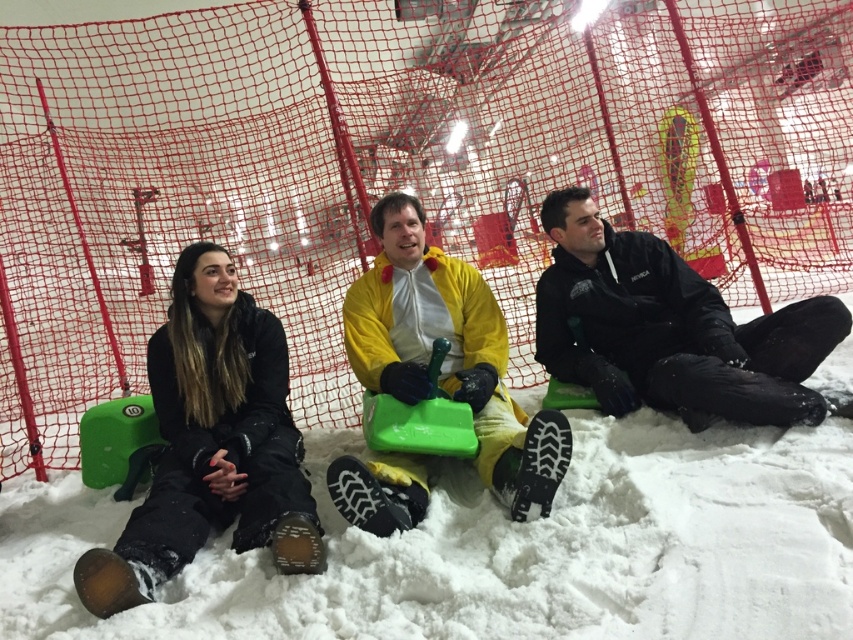
Which is more to the left, black matte snow pants at left or yellow matte snowsuit at center?

Positioned to the left is black matte snow pants at left.

Who is shorter, black matte snow pants at left or yellow matte snowsuit at center?

Standing shorter between the two is black matte snow pants at left.

In order to click on black matte snow pants at left in this screenshot , I will do `click(212, 444)`.

Does black matte jacket at center have a lesser height compared to yellow matte snowsuit at center?

Indeed, black matte jacket at center has a lesser height compared to yellow matte snowsuit at center.

Who is lower down, black matte jacket at center or yellow matte snowsuit at center?

yellow matte snowsuit at center is below.

This screenshot has width=853, height=640. Describe the element at coordinates (670, 328) in the screenshot. I see `black matte jacket at center` at that location.

Locate an element on the screen. Image resolution: width=853 pixels, height=640 pixels. black matte jacket at center is located at coordinates (670, 328).

Can you confirm if black matte snow pants at left is bigger than black matte jacket at center?

Indeed, black matte snow pants at left has a larger size compared to black matte jacket at center.

Does black matte snow pants at left appear on the left side of black matte jacket at center?

Yes, black matte snow pants at left is to the left of black matte jacket at center.

Who is more forward, (285, 410) or (692, 426)?

Point (692, 426) is more forward.

Identify the location of black matte snow pants at left. (212, 444).